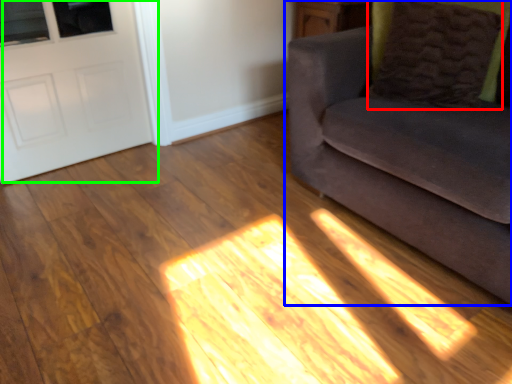
Question: Considering the real-world distances, which object is closest to pillow (highlighted by a red box)? studio couch (highlighted by a blue box) or door (highlighted by a green box).

Choices:
 (A) studio couch
 (B) door

Answer: (A)